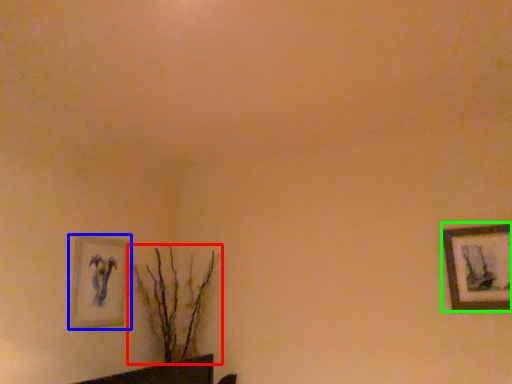
Question: Which object is the farthest from houseplant (highlighted by a red box)? Choose among these: picture frame (highlighted by a blue box) or picture frame (highlighted by a green box).

Choices:
 (A) picture frame
 (B) picture frame

Answer: (B)